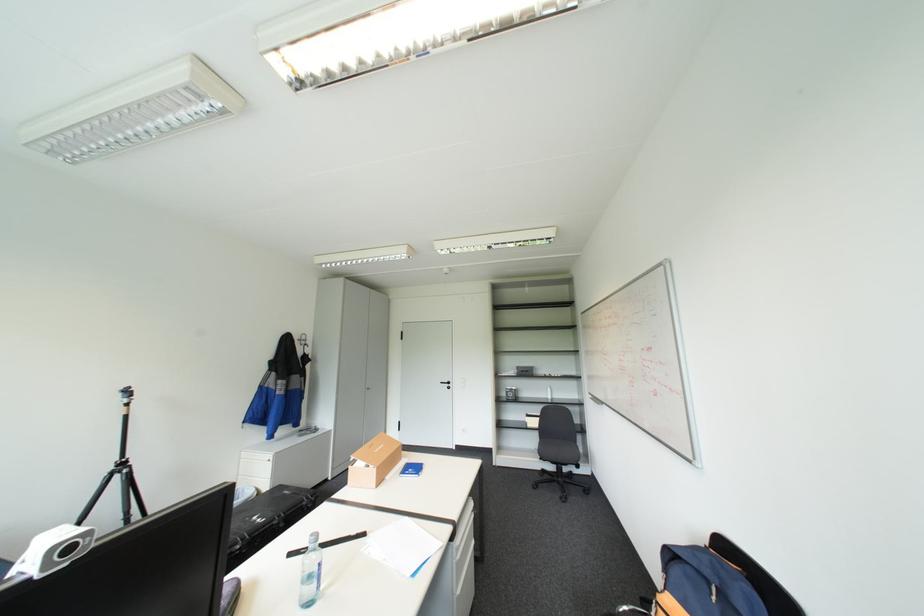
What do you see at coordinates (446, 392) in the screenshot? The height and width of the screenshot is (616, 924). I see `the black door handle` at bounding box center [446, 392].